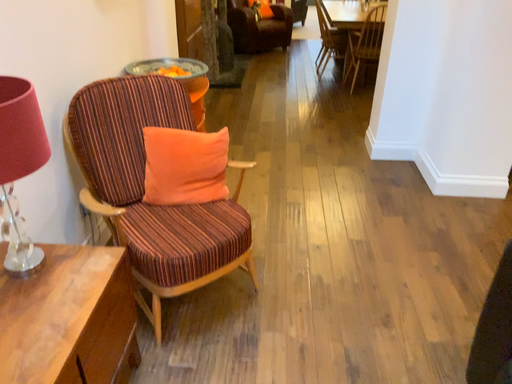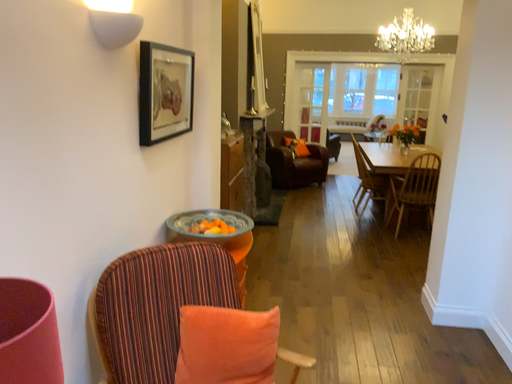
Question: How did the camera likely rotate when shooting the video?

Choices:
 (A) rotated downward
 (B) rotated upward

Answer: (B)